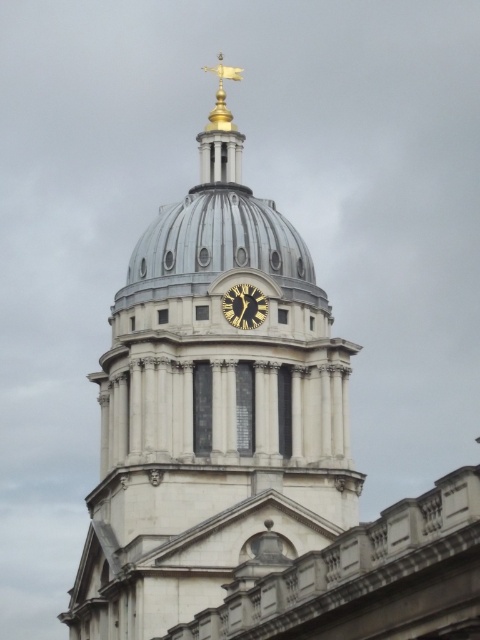
Question: Which point is farther to the camera?

Choices:
 (A) white stone dome at center
 (B) gold metallic clock at center
 (C) gold polished metal weather vane at upper center

Answer: (C)

Question: Which point is closer to the camera taking this photo?

Choices:
 (A) (196, 289)
 (B) (232, 288)
 (C) (220, 144)

Answer: (B)

Question: Is white stone dome at center above gold polished metal weather vane at upper center?

Choices:
 (A) no
 (B) yes

Answer: (A)

Question: Considering the relative positions of white stone dome at center and gold polished metal weather vane at upper center in the image provided, where is white stone dome at center located with respect to gold polished metal weather vane at upper center?

Choices:
 (A) left
 (B) right

Answer: (A)

Question: Which is farther from the gold polished metal weather vane at upper center?

Choices:
 (A) white stone dome at center
 (B) gold metallic clock at center

Answer: (A)

Question: Is white stone dome at center thinner than gold polished metal weather vane at upper center?

Choices:
 (A) no
 (B) yes

Answer: (A)